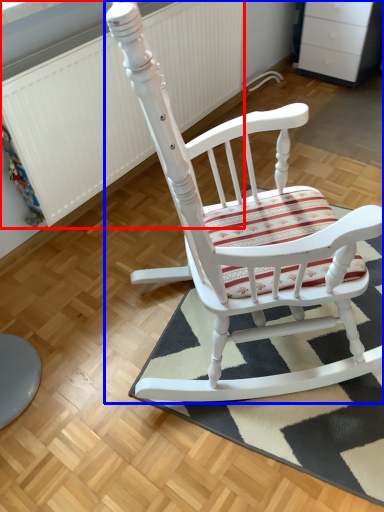
Question: Among these objects, which one is nearest to the camera, radiator (highlighted by a red box) or chair (highlighted by a blue box)?

Choices:
 (A) radiator
 (B) chair

Answer: (B)